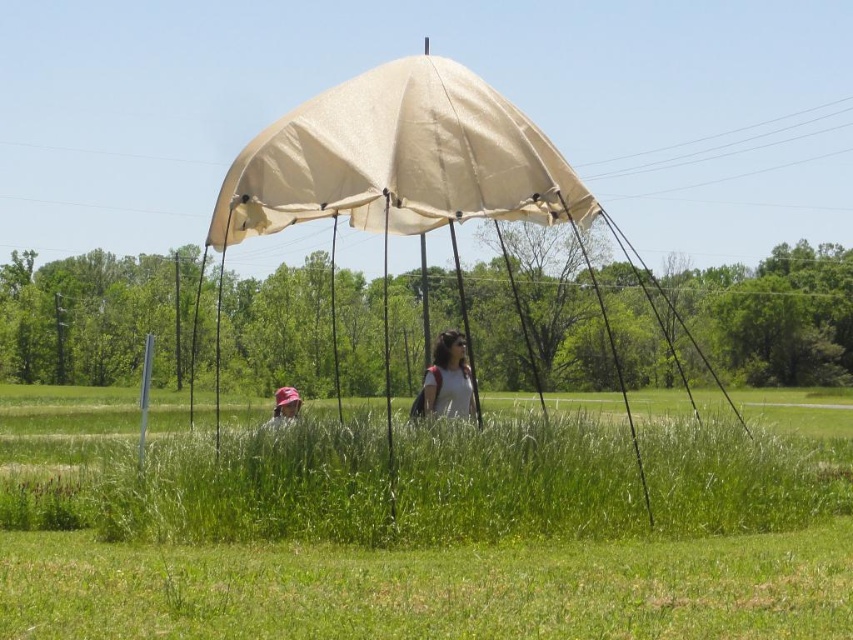
What do you see at coordinates (432, 588) in the screenshot? This screenshot has width=853, height=640. I see `green grass at center` at bounding box center [432, 588].

Can you confirm if green grass at center is positioned above matte gray backpack at center?

No.

Image resolution: width=853 pixels, height=640 pixels. What are the coordinates of `green grass at center` in the screenshot? It's located at (432, 588).

Between point (607, 330) and point (277, 403), which one is positioned behind?

Positioned behind is point (607, 330).

Does point (315, 216) come in front of point (299, 404)?

That is True.

Is point (358, 202) less distant than point (288, 417)?

Yes, point (358, 202) is in front of point (288, 417).

At what (x,y) coordinates should I click in order to perform the action: click on beige canvas umbrella at center. Please return your answer as a coordinate pair (x, y). Looking at the image, I should click on 408,180.

Who is taller, beige canvas umbrella at center or beige canvas canopy at center?

beige canvas umbrella at center

Can you confirm if beige canvas umbrella at center is bigger than beige canvas canopy at center?

Correct, beige canvas umbrella at center is larger in size than beige canvas canopy at center.

You are a GUI agent. You are given a task and a screenshot of the screen. Output one action in this format:
    pyautogui.click(x=<x>, y=<y>)
    Task: Click on the beige canvas umbrella at center
    This screenshot has width=853, height=640.
    Given the screenshot: What is the action you would take?
    [x=408, y=180]